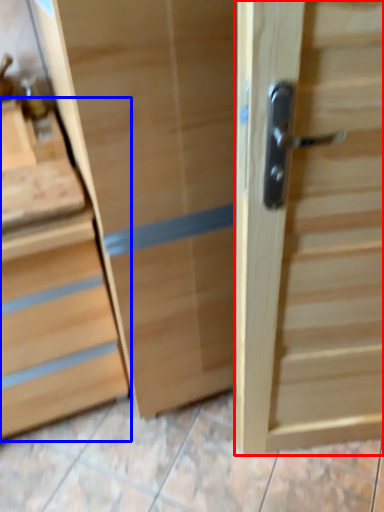
Question: Among these objects, which one is farthest to the camera, door (highlighted by a red box) or chest of drawers (highlighted by a blue box)?

Choices:
 (A) door
 (B) chest of drawers

Answer: (B)